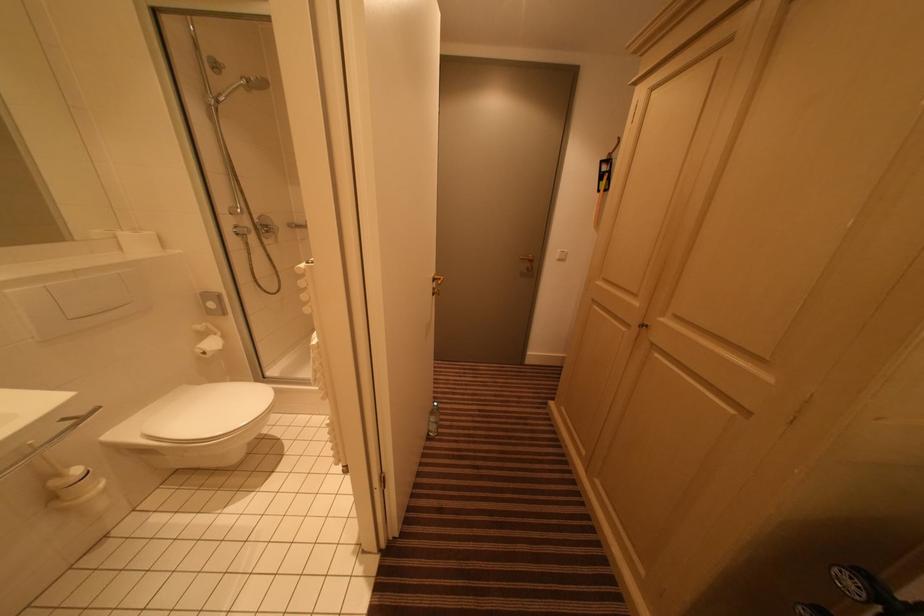
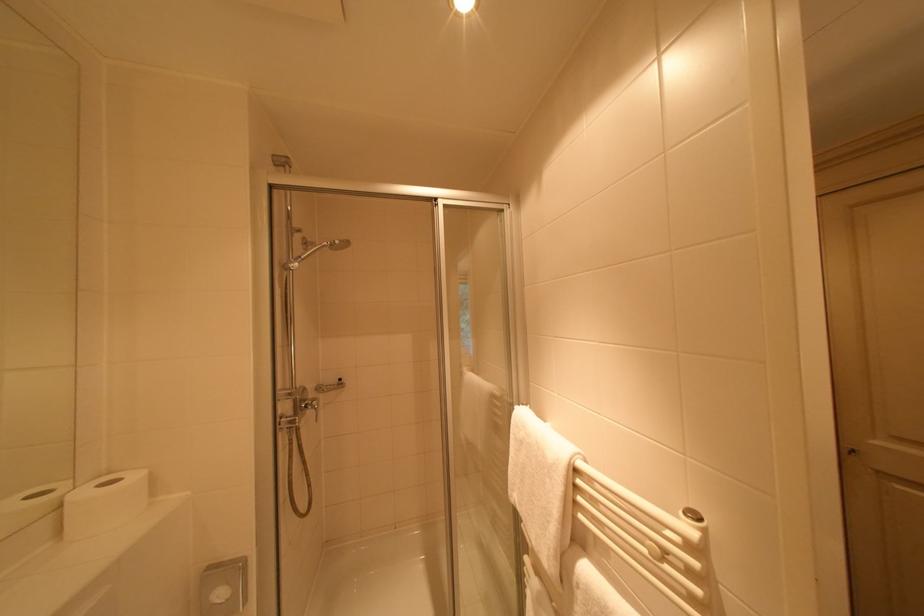
In the second image, find the point that corresponds to (153,235) in the first image.

(140, 479)